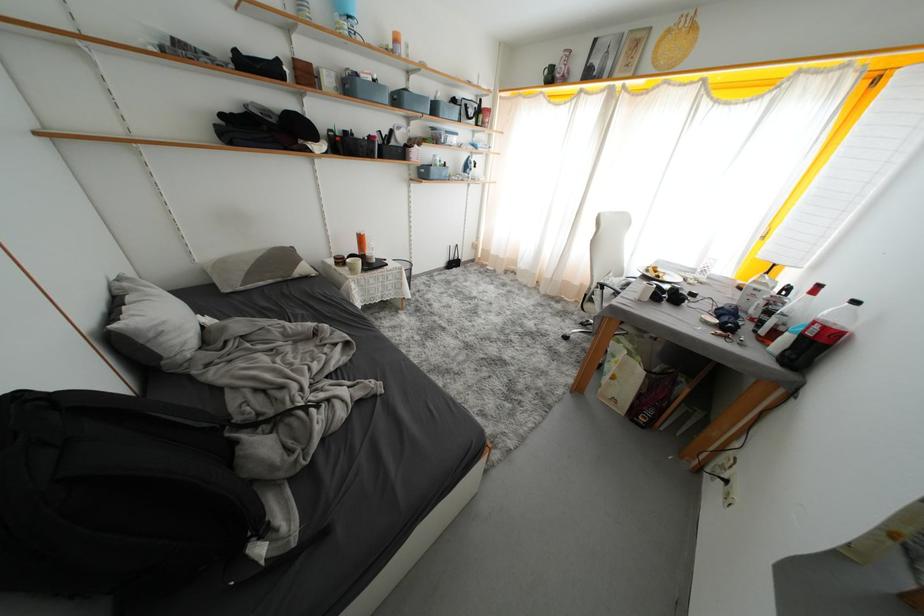
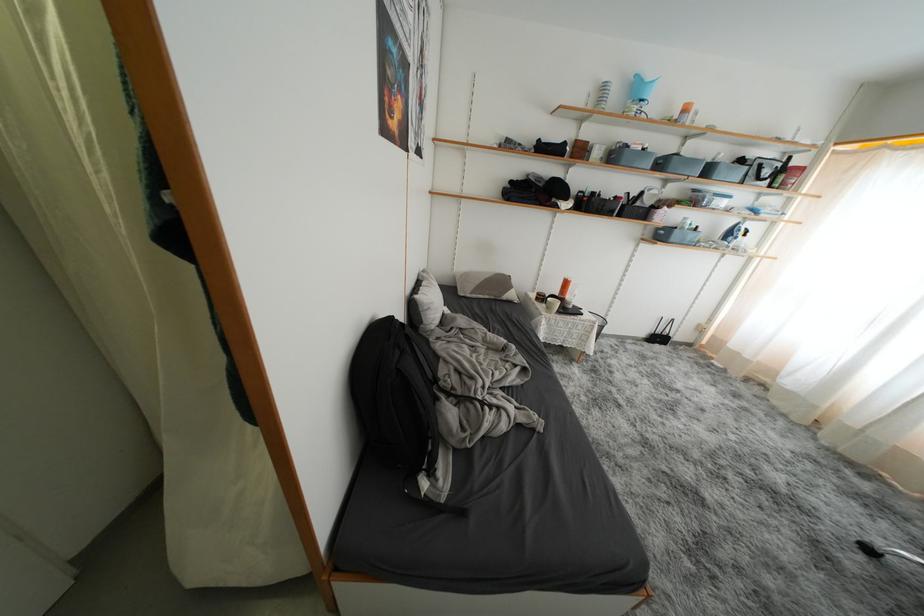
Where in the second image is the point corresponding to the point at 572,342 from the first image?

(876, 554)